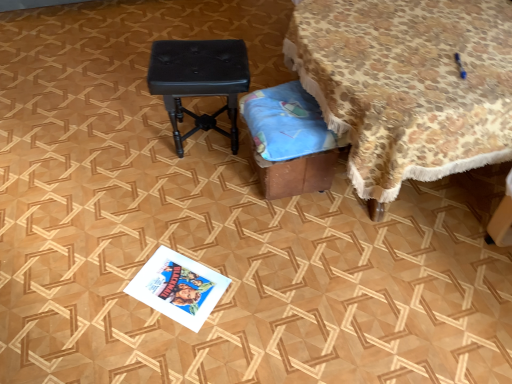
You are a GUI agent. You are given a task and a screenshot of the screen. Output one action in this format:
    pyautogui.click(x=<x>, y=<y>)
    Task: Click on the empty space that is ontop of white glossy magazine at lower center (from a real-world perspective)
    The image size is (512, 384).
    Given the screenshot: What is the action you would take?
    pyautogui.click(x=178, y=283)